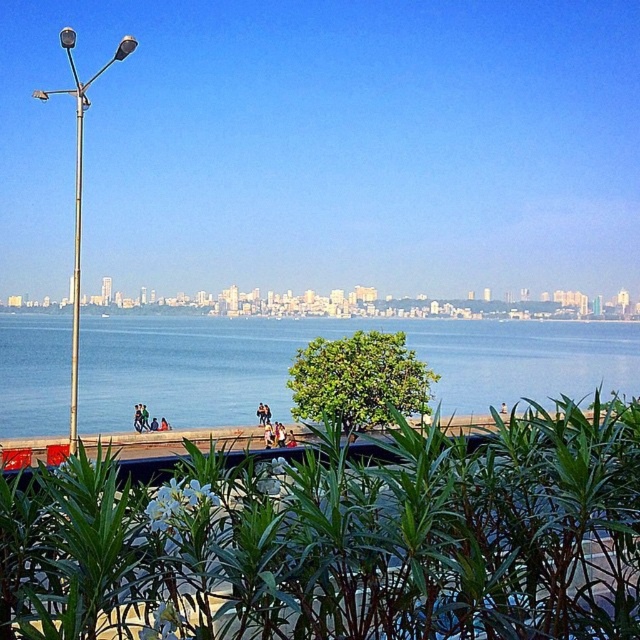
Does blue water at center appear under metallic pole at left?

Yes.

Does blue water at center have a greater height compared to metallic pole at left?

No, blue water at center is not taller than metallic pole at left.

Which is in front, point (557, 339) or point (76, 148)?

Point (557, 339) is more forward.

At what (x,y) coordinates should I click in order to perform the action: click on blue water at center. Please return your answer as a coordinate pair (x, y). The width and height of the screenshot is (640, 640). Looking at the image, I should click on (332, 337).

From the picture: Between green leafy plant at center and metallic pole at left, which one appears on the right side from the viewer's perspective?

Positioned to the right is green leafy plant at center.

Can you confirm if green leafy plant at center is wider than metallic pole at left?

No.

This screenshot has width=640, height=640. I want to click on green leafy plant at center, so click(340, 540).

Which is above, green leafy plant at center or silver metallic pole at left?

Positioned higher is silver metallic pole at left.

Does green leafy plant at center have a greater width compared to silver metallic pole at left?

No.

What are the coordinates of `green leafy plant at center` in the screenshot? It's located at (340, 540).